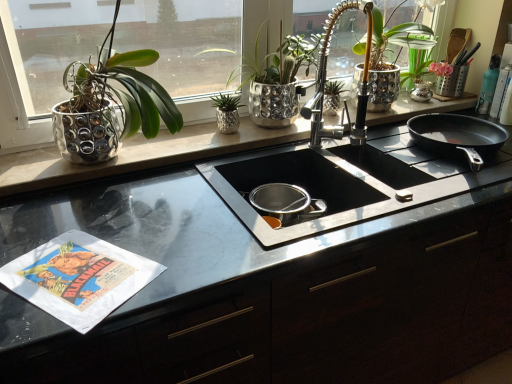
Image resolution: width=512 pixels, height=384 pixels. I want to click on free space between shiny metallic plant at left, which appears as the first houseplant when viewed from the left, and shiny metallic pot at center, marked as the 2th houseplant in a right-to-left arrangement, so click(205, 140).